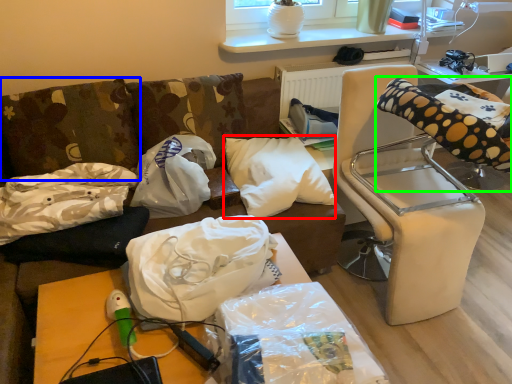
Question: Which object is the farthest from pillow (highlighted by a red box)? Choose among these: pillow (highlighted by a blue box) or bean bag chair (highlighted by a green box).

Choices:
 (A) pillow
 (B) bean bag chair

Answer: (A)